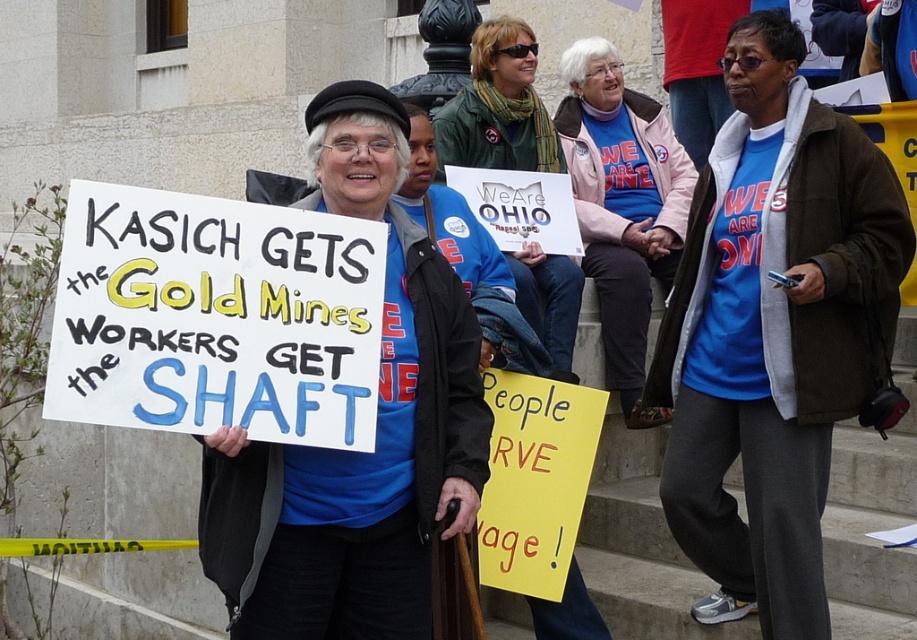
Looking at this image, is the position of blue t-shirt at center more distant than that of blue cotton shirt at center?

No, blue t-shirt at center is in front of blue cotton shirt at center.

Find the location of a particular element. This screenshot has height=640, width=917. blue t-shirt at center is located at coordinates (774, 332).

Find the location of a particular element. This screenshot has height=640, width=917. blue t-shirt at center is located at coordinates (774, 332).

Can you confirm if blue t-shirt at center is positioned above matte blue shirt at center?

Incorrect, blue t-shirt at center is not positioned above matte blue shirt at center.

Between blue t-shirt at center and matte blue shirt at center, which one has less height?

blue t-shirt at center is shorter.

Is point (735, 544) positioned behind point (481, 452)?

Yes, it is behind point (481, 452).

Find the location of a particular element. This screenshot has height=640, width=917. blue t-shirt at center is located at coordinates (774, 332).

Describe the element at coordinates (376, 429) in the screenshot. I see `matte blue shirt at center` at that location.

Between matte blue shirt at center and blue cotton shirt at center, which one appears on the right side from the viewer's perspective?

From the viewer's perspective, blue cotton shirt at center appears more on the right side.

Which is in front, point (356, 502) or point (626, 284)?

Point (356, 502) is more forward.

This screenshot has height=640, width=917. In order to click on matte blue shirt at center in this screenshot , I will do `click(376, 429)`.